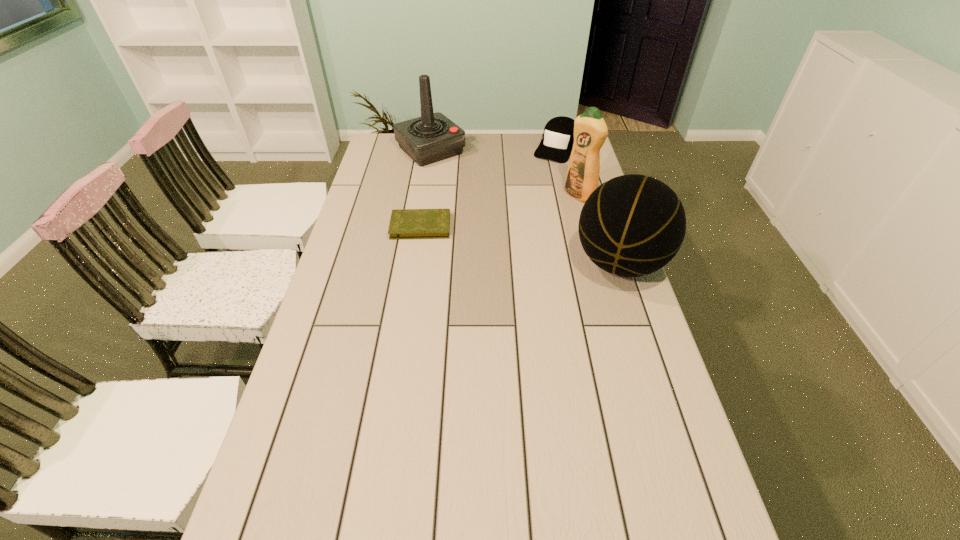
The height and width of the screenshot is (540, 960). Find the location of `basketball positioned at the right edge`. basketball positioned at the right edge is located at coordinates (632, 225).

You are a GUI agent. You are given a task and a screenshot of the screen. Output one action in this format:
    pyautogui.click(x=<x>, y=<y>)
    Task: Click on the cap situated at the right edge
    The image size is (960, 540).
    Given the screenshot: What is the action you would take?
    pyautogui.click(x=558, y=137)

You are a GUI agent. You are given a task and a screenshot of the screen. Output one action in this format:
    pyautogui.click(x=<x>, y=<y>)
    Task: Click on the detergent located at the right edge
    
    Given the screenshot: What is the action you would take?
    pyautogui.click(x=590, y=130)

This screenshot has width=960, height=540. What are the coordinates of `object that is at the far left corner` in the screenshot? It's located at (433, 137).

Where is `object present at the far right corner`? object present at the far right corner is located at coordinates (558, 137).

You are a GUI agent. You are given a task and a screenshot of the screen. Output one action in this format:
    pyautogui.click(x=<x>, y=<y>)
    Task: Click on the vacant space at the far edge of the desktop
    The image size is (960, 540).
    Given the screenshot: What is the action you would take?
    pyautogui.click(x=480, y=158)

You are a GUI agent. You are given a task and a screenshot of the screen. Output one action in this format:
    pyautogui.click(x=<x>, y=<y>)
    Task: Click on the free location at the near edge of the desktop
    
    Given the screenshot: What is the action you would take?
    pyautogui.click(x=589, y=516)

The width and height of the screenshot is (960, 540). In the image, there is a desktop. Identify the location of vacant space at the left edge. (312, 340).

I want to click on free spot at the right edge of the desktop, so click(x=679, y=431).

I want to click on vacant space at the near right corner, so click(708, 525).